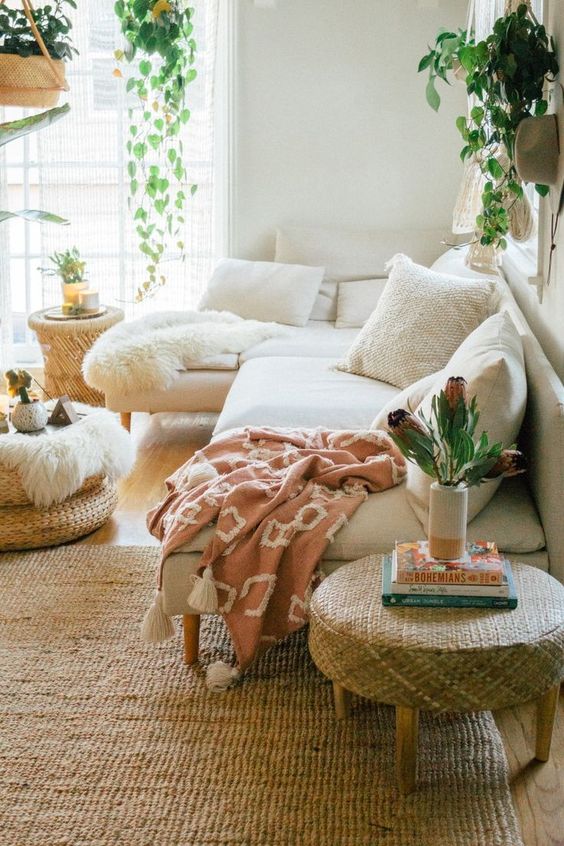
What are the coordinates of `blankets` in the screenshot? It's located at click(233, 537), click(239, 502), click(264, 525), click(160, 337), click(182, 332), click(224, 337).